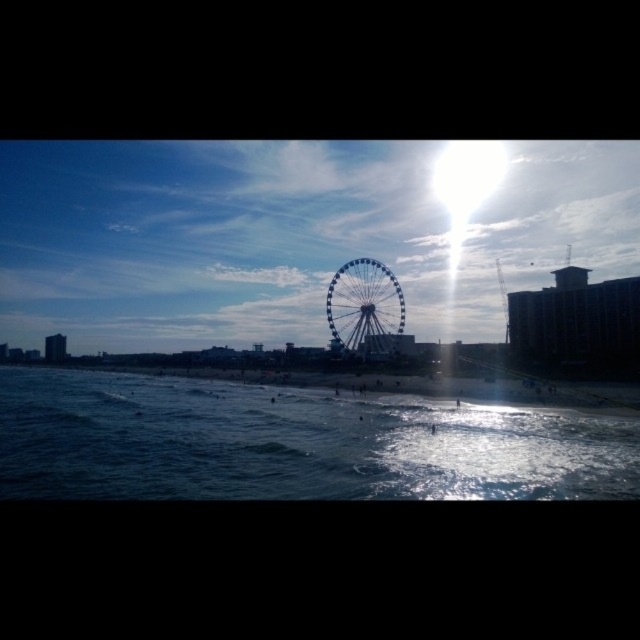
Does dark blue water at lower center have a greater height compared to silver metallic ferris wheel at center?

Yes.

Does dark blue water at lower center appear over silver metallic ferris wheel at center?

Incorrect, dark blue water at lower center is not positioned above silver metallic ferris wheel at center.

Identify the location of dark blue water at lower center. The width and height of the screenshot is (640, 640). (294, 442).

Locate an element on the screen. dark blue water at lower center is located at coordinates (294, 442).